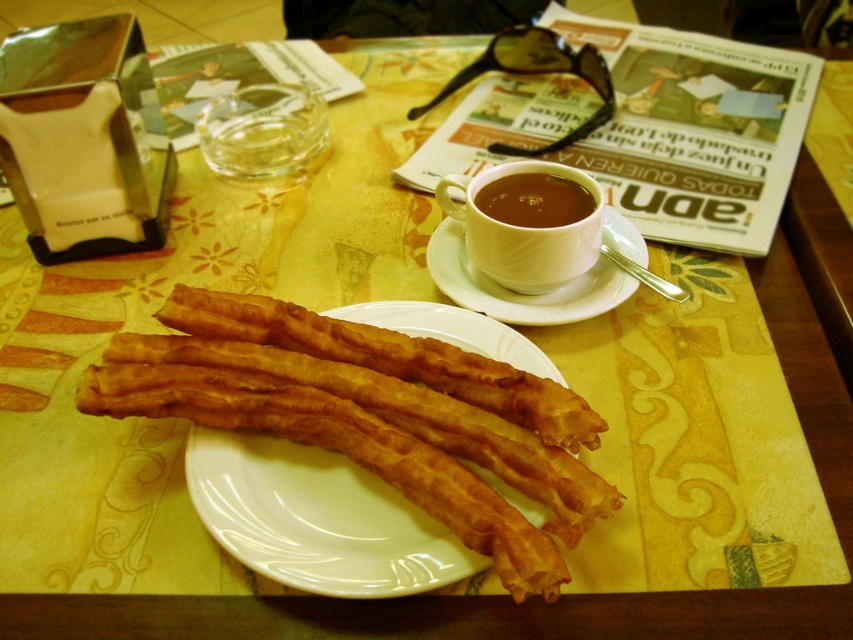
Question: Which object is closer to the camera taking this photo?

Choices:
 (A) matte ceramic plate at center
 (B) white ceramic cup at upper center
 (C) white ceramic saucer at upper center
 (D) brown matte cup at upper center

Answer: (A)

Question: Is white ceramic cup at upper center wider than white ceramic saucer at upper center?

Choices:
 (A) yes
 (B) no

Answer: (B)

Question: Does matte ceramic plate at center have a smaller size compared to white ceramic cup at upper center?

Choices:
 (A) yes
 (B) no

Answer: (B)

Question: Based on their relative distances, which object is farther from the brown matte cup at upper center?

Choices:
 (A) white ceramic cup at upper center
 (B) white ceramic saucer at upper center
 (C) matte ceramic plate at center

Answer: (C)

Question: Estimate the real-world distances between objects in this image. Which object is closer to the white ceramic saucer at upper center?

Choices:
 (A) brown matte cup at upper center
 (B) matte ceramic plate at center
 (C) white ceramic cup at upper center

Answer: (C)

Question: Is white ceramic cup at upper center below brown matte cup at upper center?

Choices:
 (A) yes
 (B) no

Answer: (A)